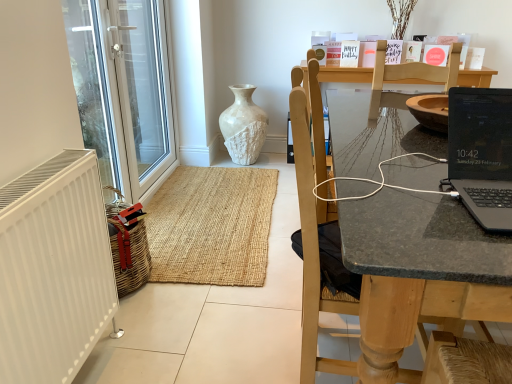
Question: Is black glossy laptop at right to the right of white matte radiator at left from the viewer's perspective?

Choices:
 (A) yes
 (B) no

Answer: (A)

Question: Is black glossy laptop at right touching white matte radiator at left?

Choices:
 (A) no
 (B) yes

Answer: (A)

Question: Is black glossy laptop at right shorter than white matte radiator at left?

Choices:
 (A) no
 (B) yes

Answer: (B)

Question: Could you tell me if black glossy laptop at right is facing white matte radiator at left?

Choices:
 (A) yes
 (B) no

Answer: (B)

Question: Considering the relative positions of black glossy laptop at right and white matte radiator at left in the image provided, is black glossy laptop at right to the left of white matte radiator at left from the viewer's perspective?

Choices:
 (A) no
 (B) yes

Answer: (A)

Question: Relative to wooden chair at right, is white matte radiator at left in front or behind?

Choices:
 (A) front
 (B) behind

Answer: (A)

Question: Would you say white matte radiator at left is to the left or to the right of wooden chair at right in the picture?

Choices:
 (A) left
 (B) right

Answer: (A)

Question: Is white matte radiator at left wider or thinner than wooden chair at right?

Choices:
 (A) wide
 (B) thin

Answer: (B)

Question: From a real-world perspective, is white matte radiator at left above or below wooden chair at right?

Choices:
 (A) above
 (B) below

Answer: (B)

Question: Considering the positions of white matte radiator at left and white textured vase at center in the image, is white matte radiator at left taller or shorter than white textured vase at center?

Choices:
 (A) tall
 (B) short

Answer: (A)

Question: Would you say white matte radiator at left is to the left or to the right of white textured vase at center in the picture?

Choices:
 (A) left
 (B) right

Answer: (A)

Question: Considering the positions of white matte radiator at left and white textured vase at center in the image, is white matte radiator at left bigger or smaller than white textured vase at center?

Choices:
 (A) big
 (B) small

Answer: (B)

Question: From the image's perspective, is white matte radiator at left above or below white textured vase at center?

Choices:
 (A) below
 (B) above

Answer: (A)

Question: Considering the positions of transparent glass door at left and white textured vase at center in the image, is transparent glass door at left bigger or smaller than white textured vase at center?

Choices:
 (A) big
 (B) small

Answer: (A)

Question: Looking at their shapes, would you say transparent glass door at left is wider or thinner than white textured vase at center?

Choices:
 (A) thin
 (B) wide

Answer: (A)